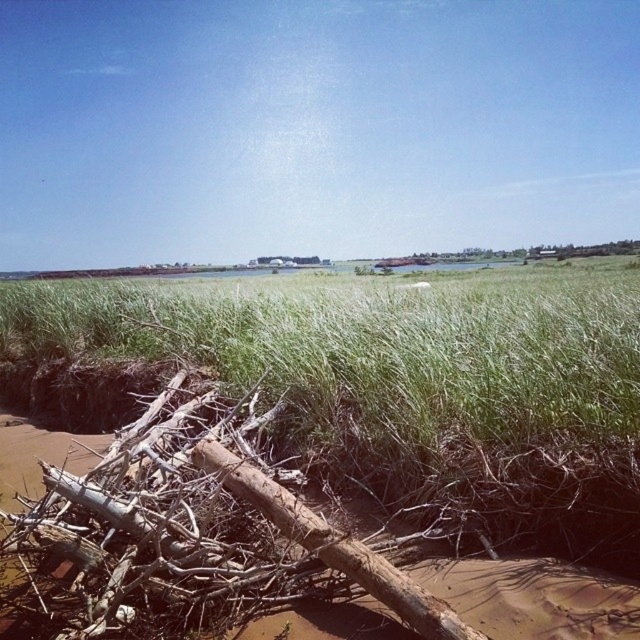
Can you confirm if green rough grass at center is thinner than brown rough wood at lower left?

No.

Does green rough grass at center lie in front of brown rough wood at lower left?

Result: No, green rough grass at center is behind brown rough wood at lower left.

Describe the element at coordinates (406, 384) in the screenshot. I see `green rough grass at center` at that location.

You are a GUI agent. You are given a task and a screenshot of the screen. Output one action in this format:
    pyautogui.click(x=<x>, y=<y>)
    Task: Click on the green rough grass at center
    The image size is (640, 640).
    Given the screenshot: What is the action you would take?
    pyautogui.click(x=406, y=384)